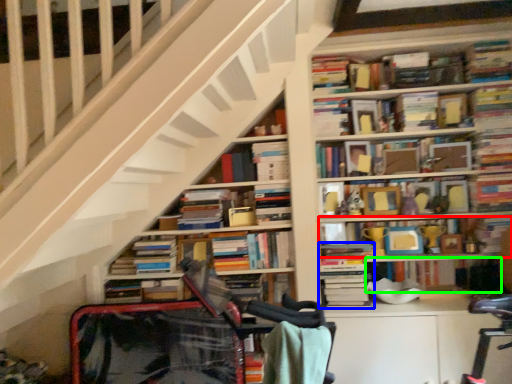
Question: Considering the real-world distances, which object is farthest from book (highlighted by a red box)? book (highlighted by a blue box) or book (highlighted by a green box)?

Choices:
 (A) book
 (B) book

Answer: (A)